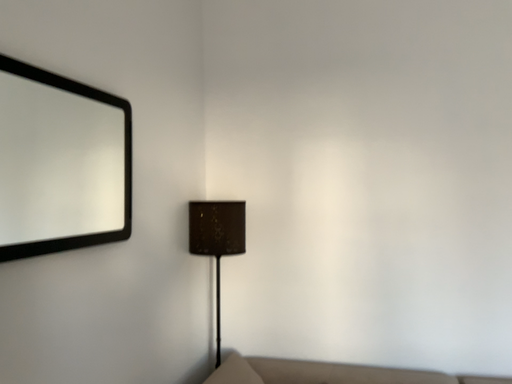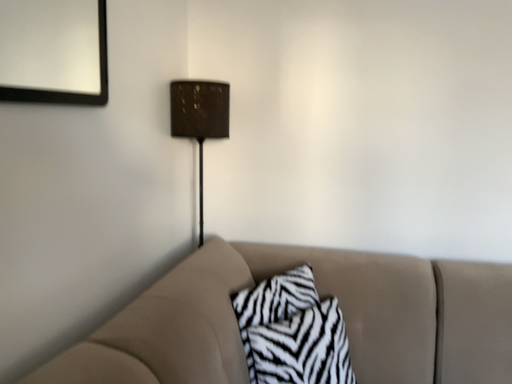
Question: How did the camera likely rotate when shooting the video?

Choices:
 (A) rotated downward
 (B) rotated upward

Answer: (A)